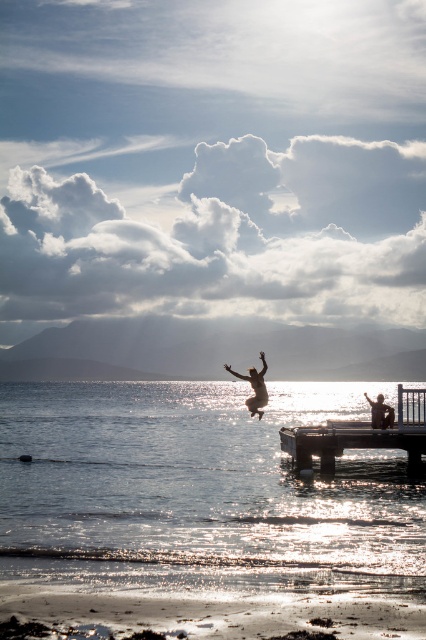
Question: Considering the relative positions of silvery reflective water at center and silhouette human at center in the image provided, where is silvery reflective water at center located with respect to silhouette human at center?

Choices:
 (A) right
 (B) left

Answer: (B)

Question: Which object is the farthest from the silvery reflective water at center?

Choices:
 (A) silhouette human at right
 (B) silhouette human at center
 (C) wooden dock at center

Answer: (A)

Question: Which object is closer to the camera taking this photo?

Choices:
 (A) silhouette human at center
 (B) silvery reflective water at center
 (C) wooden dock at center
 (D) silhouette human at right

Answer: (B)

Question: Can you confirm if wooden dock at center is wider than silhouette human at center?

Choices:
 (A) no
 (B) yes

Answer: (B)

Question: Which object appears farthest from the camera in this image?

Choices:
 (A) silhouette human at center
 (B) silhouette human at right

Answer: (B)

Question: Does wooden dock at center appear on the left side of silhouette human at right?

Choices:
 (A) yes
 (B) no

Answer: (A)